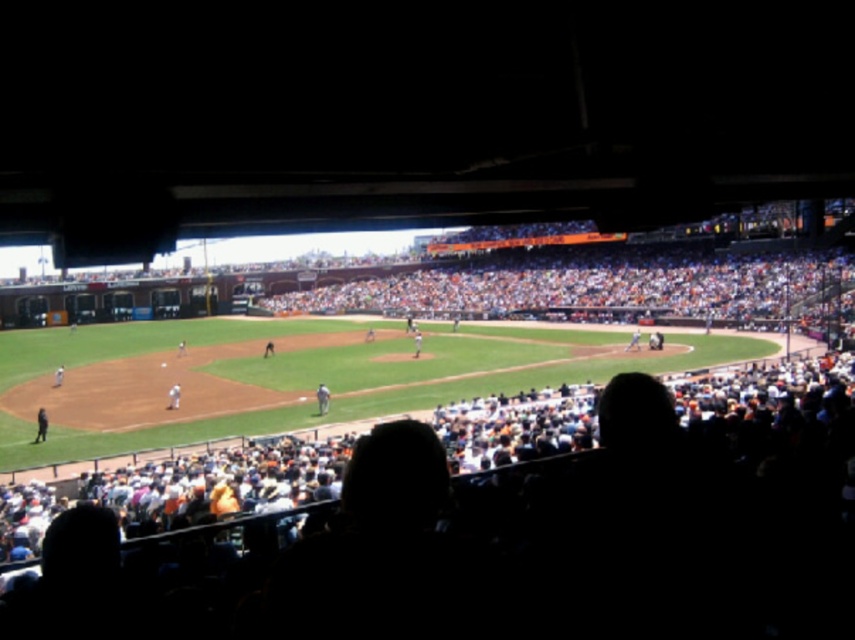
Does point (325, 406) come closer to viewer compared to point (177, 388)?

Yes, it is.

From the picture: Does white uniformed player at center have a greater width compared to white fabric uniform at center?

Incorrect, white uniformed player at center's width does not surpass white fabric uniform at center's.

Does point (325, 396) come farther from viewer compared to point (174, 403)?

No, it is not.

I want to click on white uniformed player at center, so click(322, 397).

Can you confirm if white uniformed player at center is taller than white uniform at center?

No, white uniformed player at center is not taller than white uniform at center.

Locate an element on the screen. This screenshot has height=640, width=855. white uniformed player at center is located at coordinates (322, 397).

This screenshot has height=640, width=855. Find the location of `white uniformed player at center`. white uniformed player at center is located at coordinates (322, 397).

Does dark blue uniform at lower left appear under white fabric uniform at center?

Yes, dark blue uniform at lower left is below white fabric uniform at center.

Who is positioned more to the right, dark blue uniform at lower left or white fabric uniform at center?

Positioned to the right is white fabric uniform at center.

This screenshot has width=855, height=640. In order to click on dark blue uniform at lower left in this screenshot , I will do pyautogui.click(x=40, y=426).

Where is `dark blue uniform at lower left`? This screenshot has width=855, height=640. dark blue uniform at lower left is located at coordinates (40, 426).